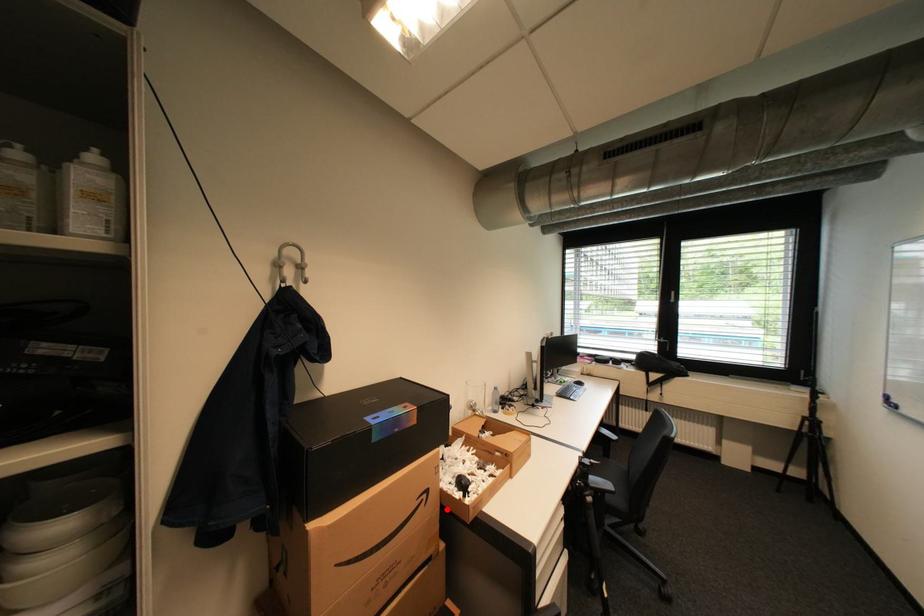
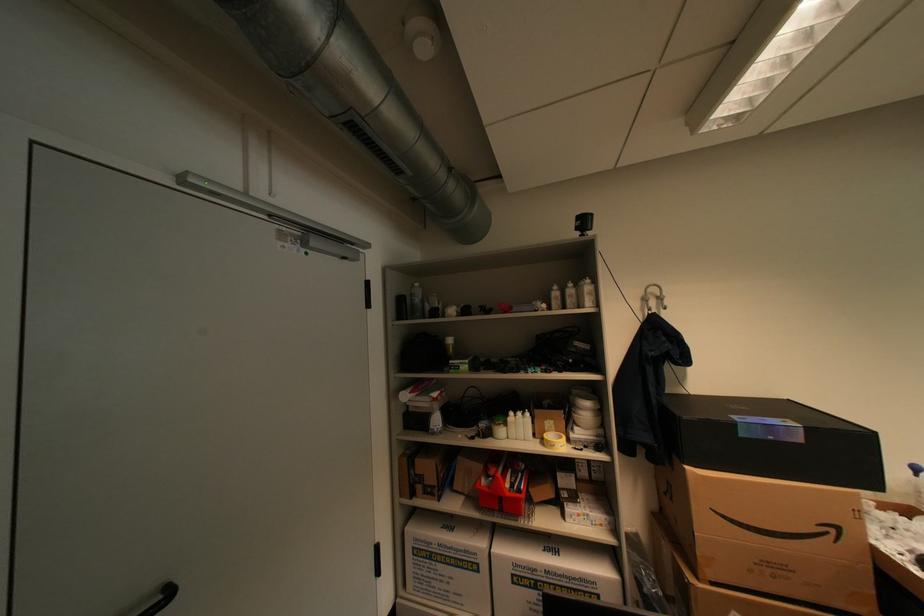
Question: I am providing you with two images of the same scene from different viewpoints. Image1 has a red point marked. In image2, the corresponding 3D location appears at what relative position? Reply with the corresponding letter.

Choices:
 (A) Closer
 (B) Farther

Answer: (A)